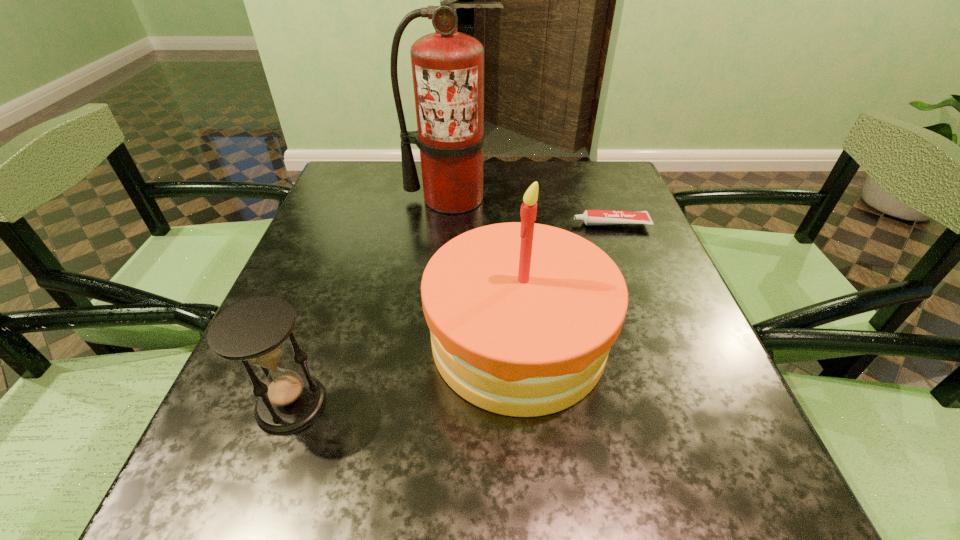
Where is `vacant space at the far left corner of the desktop`? The width and height of the screenshot is (960, 540). vacant space at the far left corner of the desktop is located at coordinates (388, 166).

This screenshot has height=540, width=960. I want to click on vacant space at the near left corner of the desktop, so click(299, 471).

The width and height of the screenshot is (960, 540). In order to click on vacant space at the far right corner of the desktop in this screenshot , I will do `click(575, 162)`.

Image resolution: width=960 pixels, height=540 pixels. I want to click on vacant area at the near right corner, so click(695, 479).

Where is `free space between the fire extinguisher and the third tallest object`? This screenshot has width=960, height=540. free space between the fire extinguisher and the third tallest object is located at coordinates (372, 301).

Locate an element on the screen. object that is the second nearest to the birthday cake is located at coordinates (590, 217).

Locate which object is the third closest to the third shortest object. Please provide its 2D coordinates. Your answer should be formatted as a tuple, i.e. [(x, y)], where the tuple contains the x and y coordinates of a point satisfying the conditions above.

[(447, 66)]

Identify the location of free spot that satisfies the following two spatial constraints: 1. toward the nozzle of the farthest object; 2. on the right side of the birthday cake. (439, 340).

Where is `vacant area in the image that satisfies the following two spatial constraints: 1. on the back side of the third shortest object; 2. on the right side of the second shortest object`? This screenshot has width=960, height=540. vacant area in the image that satisfies the following two spatial constraints: 1. on the back side of the third shortest object; 2. on the right side of the second shortest object is located at coordinates (314, 340).

Where is `free space that satisfies the following two spatial constraints: 1. at the nozzle of the toothpaste; 2. on the front side of the leftmost object`? free space that satisfies the following two spatial constraints: 1. at the nozzle of the toothpaste; 2. on the front side of the leftmost object is located at coordinates [x=680, y=404].